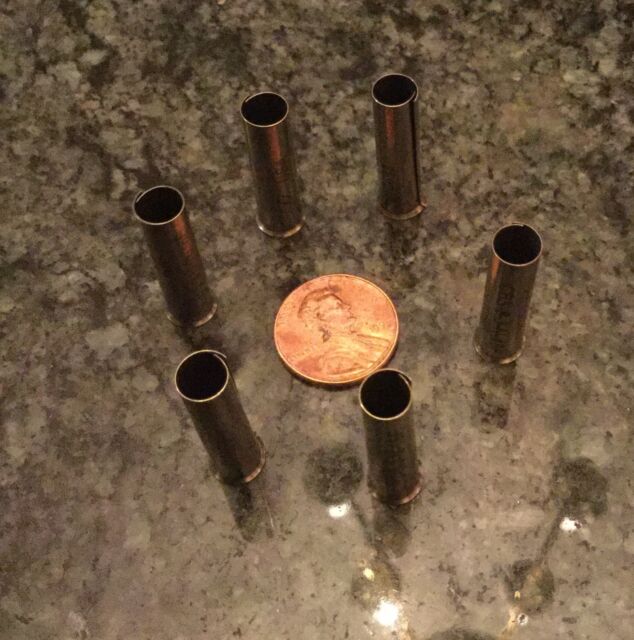
Where is `reflection of lights on the counter`? reflection of lights on the counter is located at coordinates (387, 616), (343, 513), (563, 525), (515, 612).